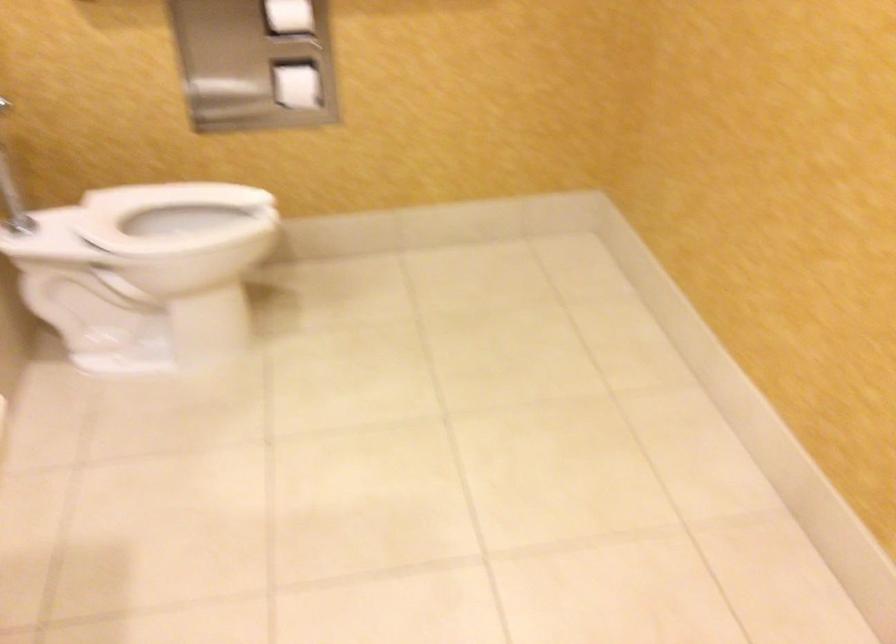
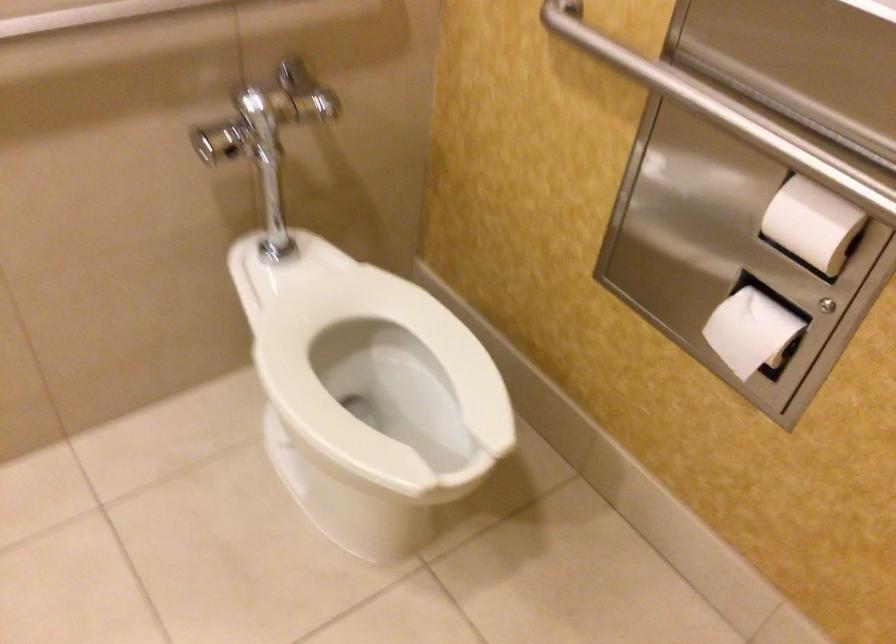
Locate, in the second image, the point that corresponds to pixel 151 261 in the first image.

(380, 381)